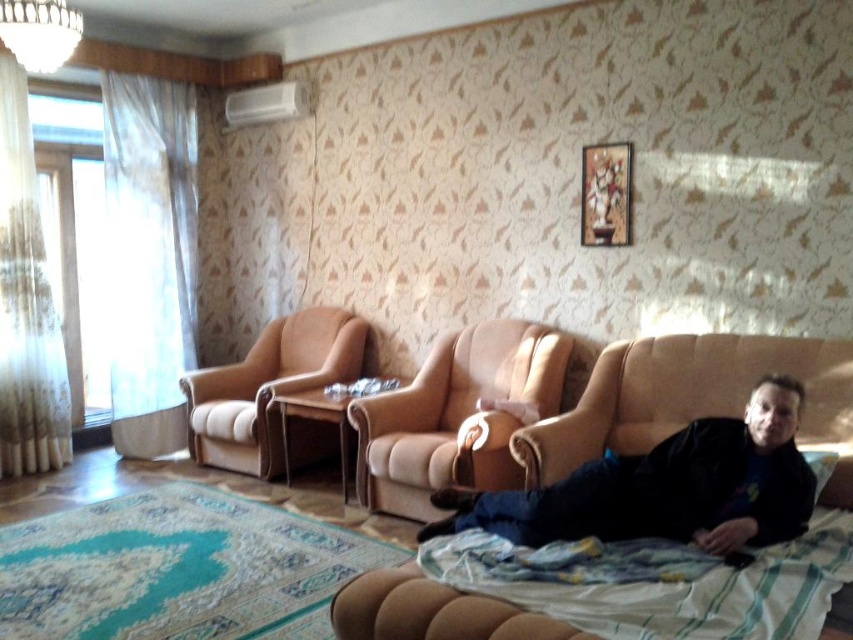
You are standing in the living room and notice two points marked on the wall. The first point is at coordinate point (x=666, y=342) and the second point is at coordinate point (x=387, y=410). If you were to walk towards the wall, which point would you encounter first?

Point (x=666, y=342) is in front of point (x=387, y=410), so you would encounter point (x=666, y=342) first when walking towards the wall.

You are a delivery person trying to place a large package in the living room. The package measures 30 inches in length. You see the beige fabric couch at lower right and the suede beige armchair at center. Can you fit the package between them without moving any furniture?

The distance between the beige fabric couch at lower right and the suede beige armchair at center is 27.02 inches. Since the package is 30 inches long, which is longer than the available space, it won

You are a guest in this living room and want to sit down on the sofa. However, there is a black matte shirt at lower right and a blue striped fabric at lower right on the sofa. Which item is closer to you when you approach the sofa?

The black matte shirt at lower right is closer to you because the blue striped fabric at lower right is behind it.